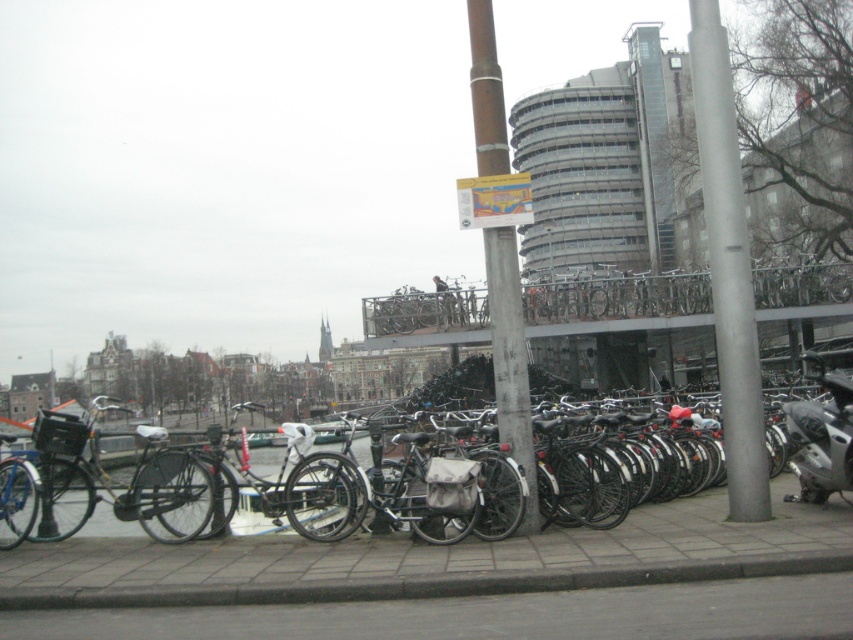
You are a delivery person who needs to choose between the matte black bicycle at left and the silver metallic motorcycle at right for a short trip around the waterfront. Considering their sizes, which one might be easier to maneuver through tight spaces?

The silver metallic motorcycle at right is smaller in size than the matte black bicycle at left, so it would be easier to maneuver through tight spaces around the waterfront.

You are standing at the point marked as point (444, 621). You want to reach the signpost near the raised platform. The path you need to take is 5.76 meters long. Can you estimate how far you need to walk to reach the signpost?

The distance between point (444, 621) and the signpost near the raised platform is 5.76 meters, so you need to walk 5.76 meters to reach the signpost.